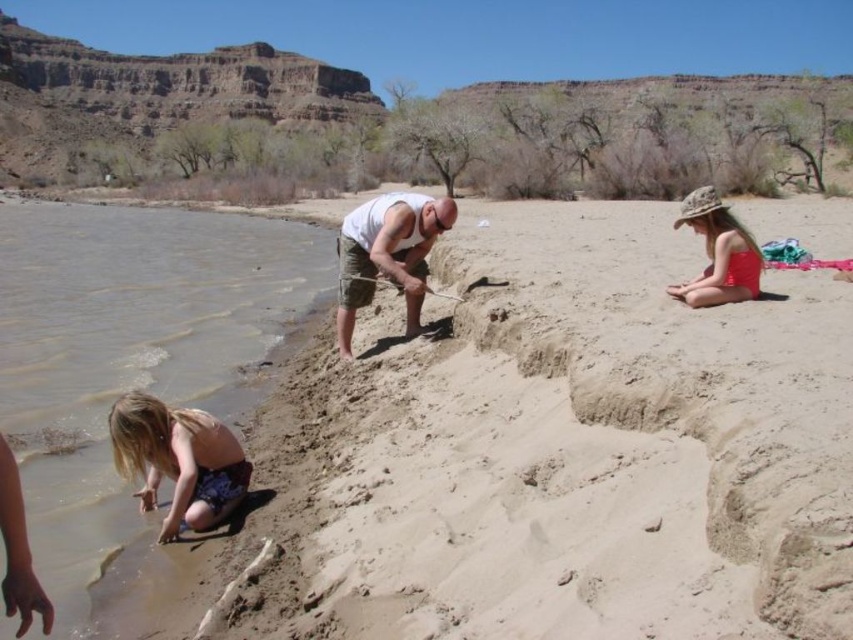
Does white tank top at center lie behind matte pink swimsuit at right?

Yes.

This screenshot has height=640, width=853. What are the coordinates of `white tank top at center` in the screenshot? It's located at (387, 253).

Image resolution: width=853 pixels, height=640 pixels. I want to click on blonde hair girl at lower left, so click(x=178, y=460).

Measure the distance between blonde hair girl at lower left and matte pink swimsuit at right.

35.15 meters

Locate an element on the screen. This screenshot has height=640, width=853. blonde hair girl at lower left is located at coordinates (178, 460).

Can you confirm if blonde hair girl at lower left is thinner than white tank top at center?

Indeed, blonde hair girl at lower left has a lesser width compared to white tank top at center.

Can you confirm if blonde hair girl at lower left is shorter than white tank top at center?

Correct, blonde hair girl at lower left is not as tall as white tank top at center.

What do you see at coordinates (178, 460) in the screenshot?
I see `blonde hair girl at lower left` at bounding box center [178, 460].

Locate an element on the screen. blonde hair girl at lower left is located at coordinates (178, 460).